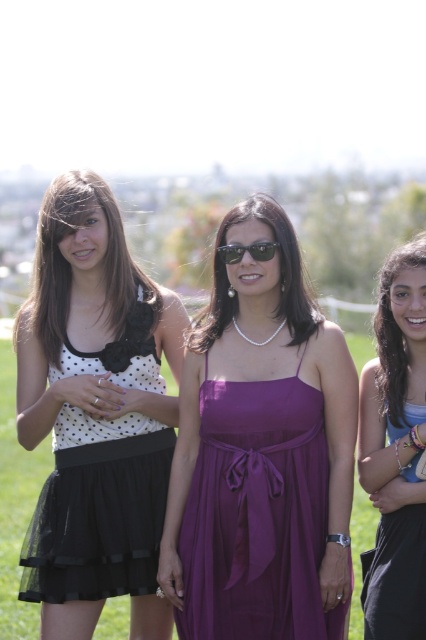
Question: Is matte purple dress at center wider than matte purple dress at right?

Choices:
 (A) no
 (B) yes

Answer: (A)

Question: Does white dotted fabric dress at left appear on the left side of green grass at center?

Choices:
 (A) yes
 (B) no

Answer: (B)

Question: Does matte purple dress at center come in front of matte purple dress at right?

Choices:
 (A) no
 (B) yes

Answer: (A)

Question: Based on their relative distances, which object is farther from the matte purple dress at center?

Choices:
 (A) sunglasses at center
 (B) white dotted fabric at left
 (C) green grass at center
 (D) purple satin dress at center

Answer: (C)

Question: Which point is closer to the camera?

Choices:
 (A) pearl necklace at center
 (B) purple satin dress at center

Answer: (B)

Question: Which object is the closest to the matte purple dress at right?

Choices:
 (A) white dotted fabric at left
 (B) green grass at center
 (C) sunglasses at center
 (D) white dotted fabric dress at left

Answer: (C)